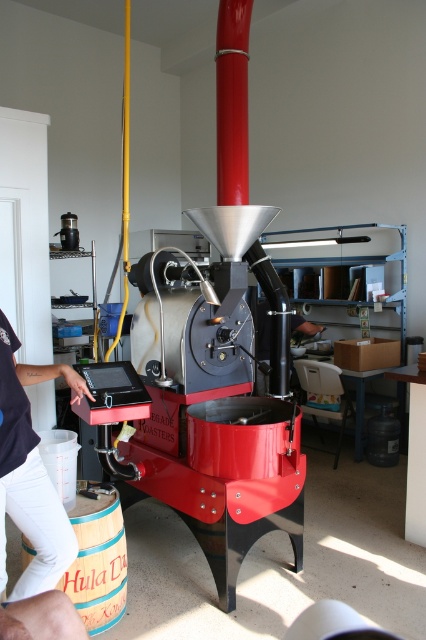
Question: Which of the following is the closest to the observer?

Choices:
 (A) dark blue shirt at left
 (B) wooden barrel at lower left

Answer: (A)

Question: Is dark blue shirt at left wider than wooden barrel at lower left?

Choices:
 (A) no
 (B) yes

Answer: (A)

Question: Does dark blue shirt at left appear on the right side of wooden barrel at lower left?

Choices:
 (A) no
 (B) yes

Answer: (A)

Question: Can you confirm if dark blue shirt at left is positioned to the left of wooden barrel at lower left?

Choices:
 (A) no
 (B) yes

Answer: (B)

Question: Which object appears farthest from the camera in this image?

Choices:
 (A) wooden barrel at lower left
 (B) dark blue shirt at left

Answer: (A)